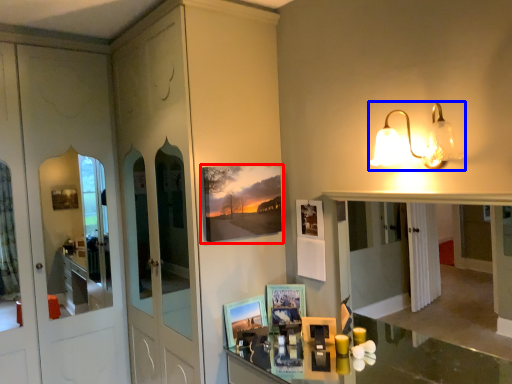
Question: Which object is closer to the camera taking this photo, picture frame (highlighted by a red box) or light fixture (highlighted by a blue box)?

Choices:
 (A) picture frame
 (B) light fixture

Answer: (B)